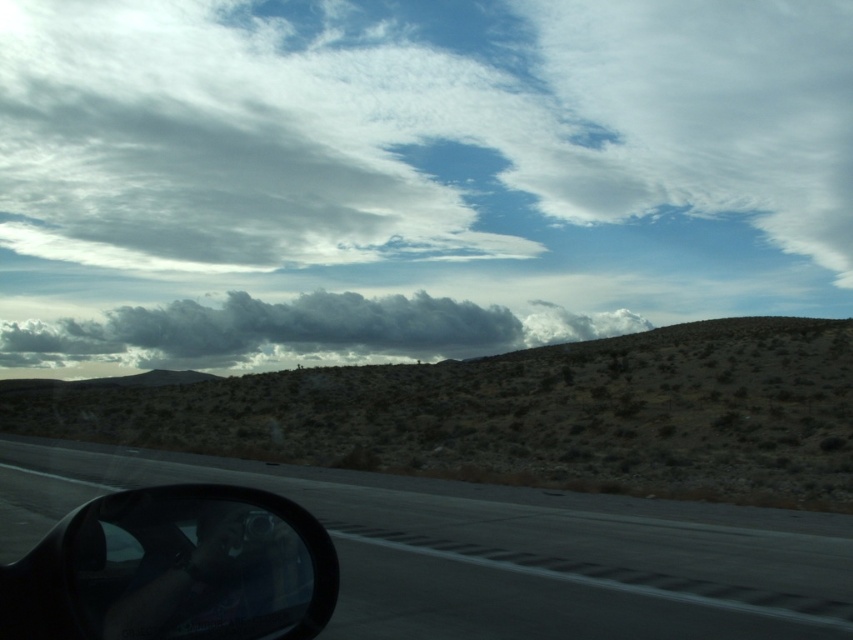
Question: Which point is closer to the camera?

Choices:
 (A) (531, 588)
 (B) (633, 392)
 (C) (177, 307)
 (D) (90, 522)

Answer: (D)

Question: Does brown/dry grassy hill at center have a lesser width compared to dark gray fluffy cloud at center?

Choices:
 (A) no
 (B) yes

Answer: (B)

Question: Estimate the real-world distances between objects in this image. Which object is farther from the black glossy side mirror at lower left?

Choices:
 (A) asphalt road at lower left
 (B) brown/dry grassy hill at center
 (C) dark gray fluffy cloud at center

Answer: (C)

Question: Is brown/dry grassy hill at center below dark gray fluffy cloud at center?

Choices:
 (A) yes
 (B) no

Answer: (A)

Question: Based on their relative distances, which object is farther from the asphalt road at lower left?

Choices:
 (A) brown/dry grassy hill at center
 (B) black glossy side mirror at lower left
 (C) dark gray fluffy cloud at center

Answer: (C)

Question: Is brown/dry grassy hill at center to the left of asphalt road at lower left from the viewer's perspective?

Choices:
 (A) no
 (B) yes

Answer: (A)